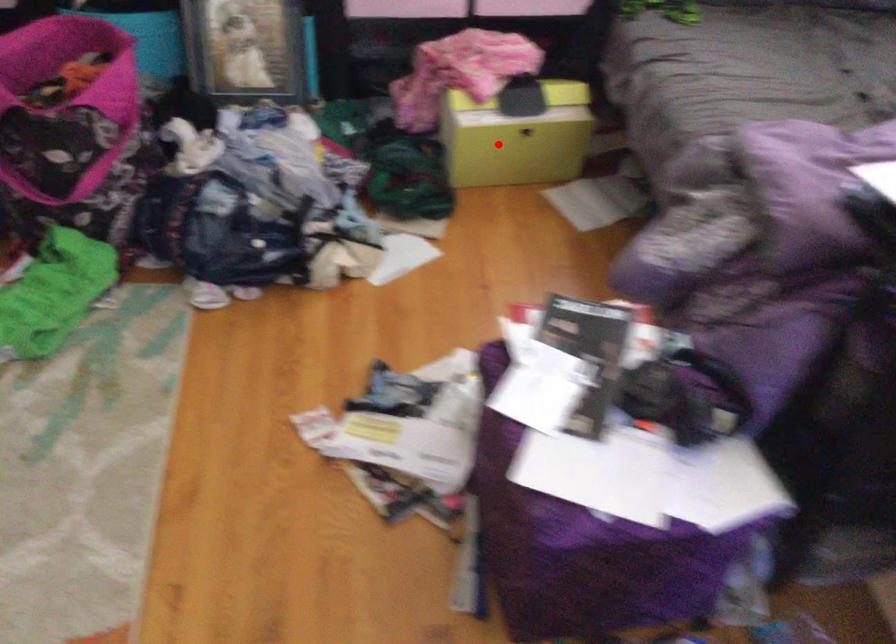
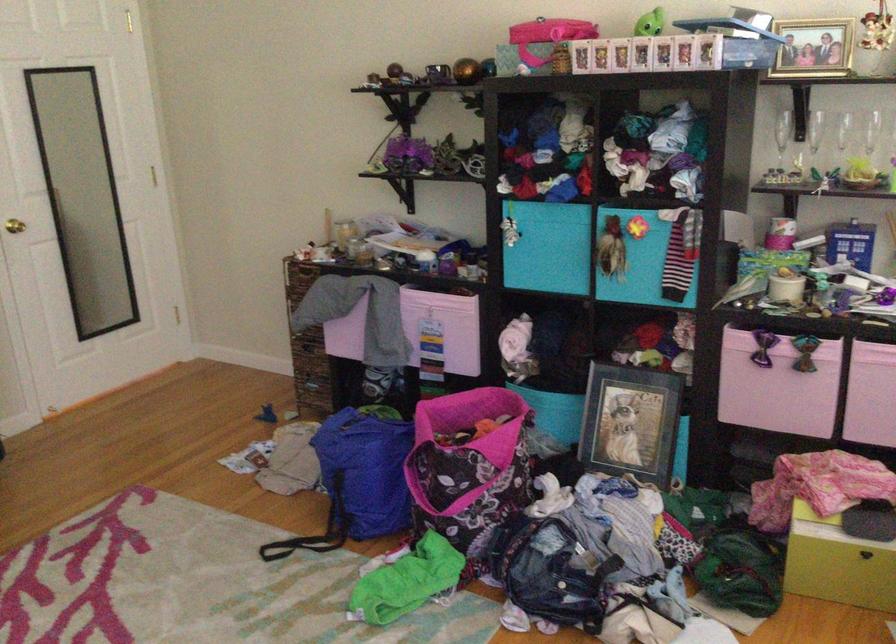
In the second image, find the point that corresponds to the highlighted location in the first image.

(838, 563)